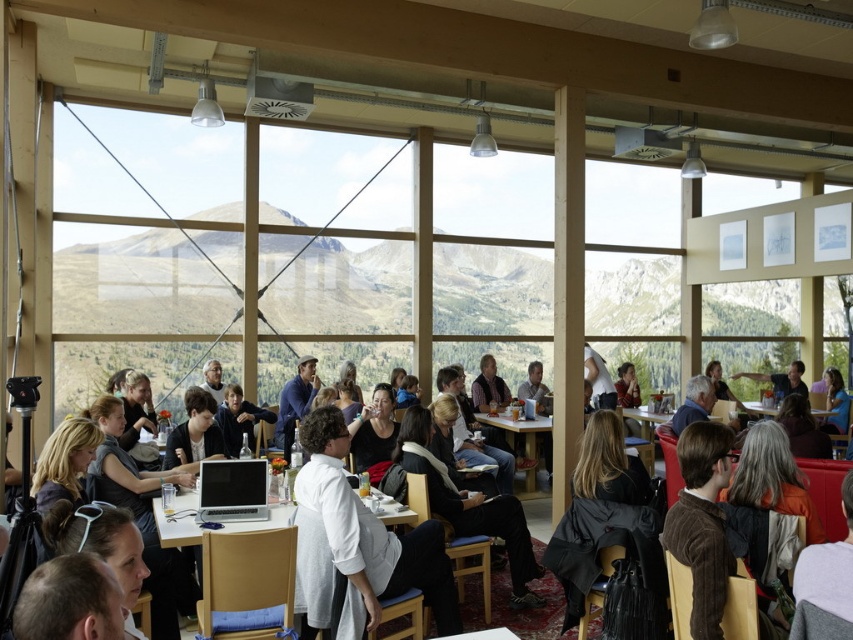
You are a guest at this event and need to place your dark brown leather jacket at lower right on the wooden table at center. Is the jacket too tall to fit on the table?

The wooden table at center is much taller than the dark brown leather jacket at lower right, so the jacket will fit on the table since the table is taller than the jacket.

You are standing at the entrance of the room and want to find the white matte sweater at center. Based on the coordinates provided, which direction should you look to locate it?

The white matte sweater at center is located at coordinates point [370,534], which would be towards the right side of the room from the entrance. You should look to your right to find it.